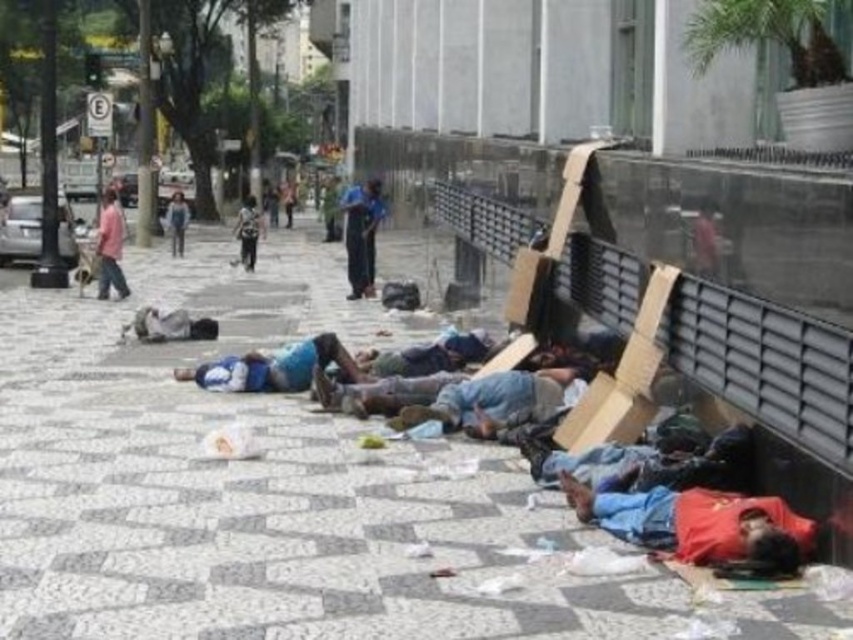
You are a photographer taking a picture of the scene. You notice the red fabric shirt at lower right and the blue fabric pants at center. Which of these two items is positioned more to the right in the image?

The red fabric shirt at lower right is positioned more to the right than the blue fabric pants at center.

Based on the photo, you are a photographer trying to capture a candid shot of the red fabric shirt at lower right and the blue fabric pants at center. Since you want to ensure both are fully visible in the frame, which clothing item should you focus on first to avoid cropping the bottom of the image?

The red fabric shirt at lower right is shorter than the blue fabric pants at center, so you should focus on the blue fabric pants at center first to ensure its full length is captured before adjusting the frame for the shorter red fabric shirt at lower right.